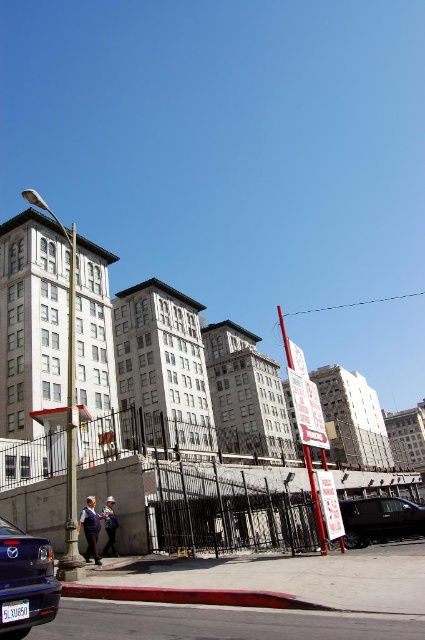
What are the coordinates of the metallic blue sedan at lower left in the image?

The metallic blue sedan at lower left is located at coordinates point (25, 580).

You are a delivery person trying to park your shiny black van at lower right. There is a metallic blue sedan at lower left blocking the parking spot. Can you move the sedan to access the parking spot?

The metallic blue sedan at lower left is positioned over the shiny black van at lower right, meaning the sedan is blocking the parking spot. You will need to move the metallic blue sedan at lower left to access the parking spot.